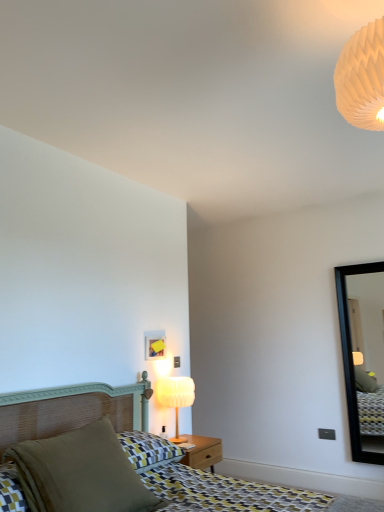
Question: Is black frame mirror at right taller or shorter than matte green pillow at lower left?

Choices:
 (A) short
 (B) tall

Answer: (B)

Question: Is black frame mirror at right wider or thinner than matte green pillow at lower left?

Choices:
 (A) wide
 (B) thin

Answer: (B)

Question: Estimate the real-world distances between objects in this image. Which object is closer to the matte yellow picture frame at center?

Choices:
 (A) matte wicker bed at lower left
 (B) black frame mirror at right
 (C) white paper honeycomb at upper right
 (D) matte white lamp at center
 (E) matte green pillow at lower left

Answer: (D)

Question: Which object is positioned farthest from the matte white lamp at center?

Choices:
 (A) matte wicker bed at lower left
 (B) black frame mirror at right
 (C) matte yellow picture frame at center
 (D) white paper honeycomb at upper right
 (E) matte green pillow at lower left

Answer: (D)